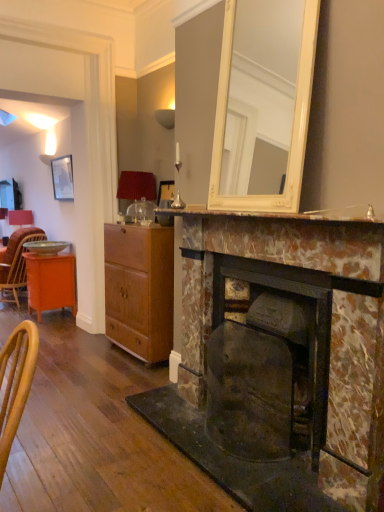
Question: From the image's perspective, is marble mantelpiece at center positioned above or below orange wood desk at left?

Choices:
 (A) above
 (B) below

Answer: (A)

Question: Is marble mantelpiece at center inside the boundaries of orange wood desk at left, or outside?

Choices:
 (A) inside
 (B) outside

Answer: (B)

Question: Based on their relative distances, which object is farther from the matte red lampshade at center?

Choices:
 (A) wooden wicker chair at left
 (B) rusty metal fireplace at center, which appears as the first fireplace when viewed from the back
 (C) orange wood desk at left
 (D) wooden cabinet at center
 (E) matte black picture frame at upper left

Answer: (A)

Question: Which object is positioned closest to the wooden cabinet at center?

Choices:
 (A) orange wood desk at left
 (B) marble fireplace at center, placed as the 2th fireplace when sorted from back to front
 (C) matte red lampshade at center
 (D) marble mantelpiece at center
 (E) matte black picture frame at upper left

Answer: (C)